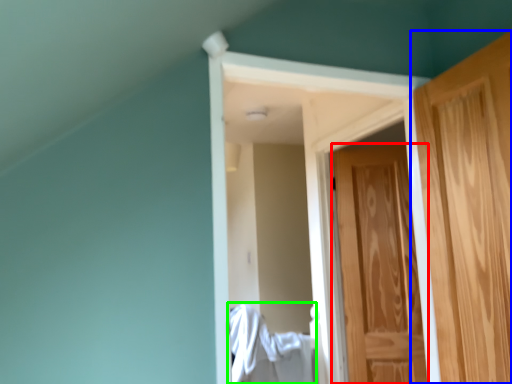
Question: Which is farther away from door (highlighted by a red box)? door (highlighted by a blue box) or laundry (highlighted by a green box)?

Choices:
 (A) door
 (B) laundry

Answer: (A)